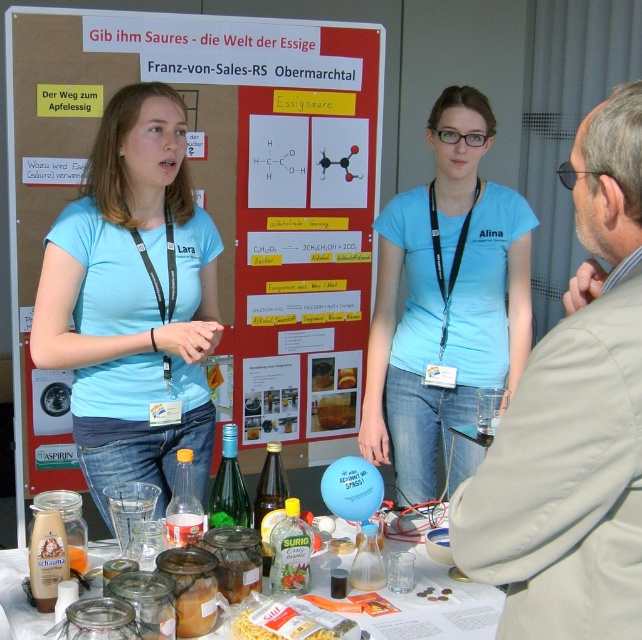
You are a visitor at the science fair and want to take a photo of both Lara and Alina. Based on their positions at point (28, 353) and point (277, 602), which one is closer to your camera so you can focus on them first?

Point (28, 353) is further to the camera than point (277, 602), so you should focus on point (277, 602) first since it is closer to your camera.

You are a visitor at the science fair and see the red cardboard poster at center and the white matte pasta at center on the table. Which object is placed above the other?

The red cardboard poster at center is positioned over the white matte pasta at center.